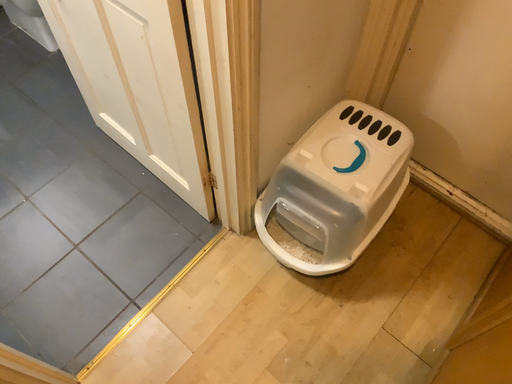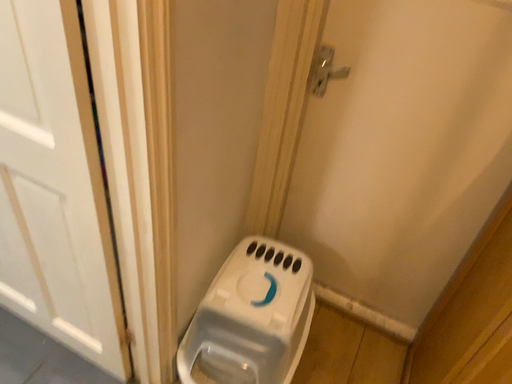
Question: Which way did the camera rotate in the video?

Choices:
 (A) rotated upward
 (B) rotated downward

Answer: (A)